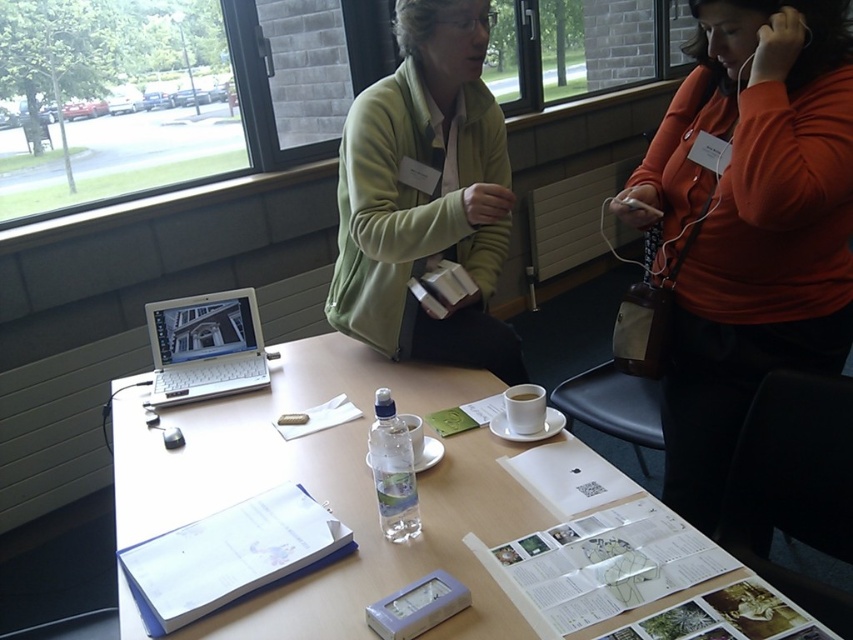
Does white paper at center have a greater width compared to green fleece jacket at upper center?

Correct, the width of white paper at center exceeds that of green fleece jacket at upper center.

Does white paper at center appear over green fleece jacket at upper center?

No, white paper at center is not above green fleece jacket at upper center.

Image resolution: width=853 pixels, height=640 pixels. Find the location of `white paper at center`. white paper at center is located at coordinates (329, 490).

Can you confirm if orange matte sweater at upper right is taller than white plastic laptop at center?

Yes.

Who is higher up, orange matte sweater at upper right or white plastic laptop at center?

orange matte sweater at upper right is above.

Which is behind, point (840, 122) or point (204, 348)?

Point (204, 348)

Locate an element on the screen. orange matte sweater at upper right is located at coordinates (750, 225).

Is white paper at center thinner than white ceramic cup at center?

No, white paper at center is not thinner than white ceramic cup at center.

Who is positioned more to the right, white paper at center or white ceramic cup at center?

Result: white ceramic cup at center

Does point (309, 625) lie behind point (521, 397)?

No, (309, 625) is in front of (521, 397).

At what (x,y) coordinates should I click in order to perform the action: click on white paper at center. Please return your answer as a coordinate pair (x, y). Image resolution: width=853 pixels, height=640 pixels. Looking at the image, I should click on (329, 490).